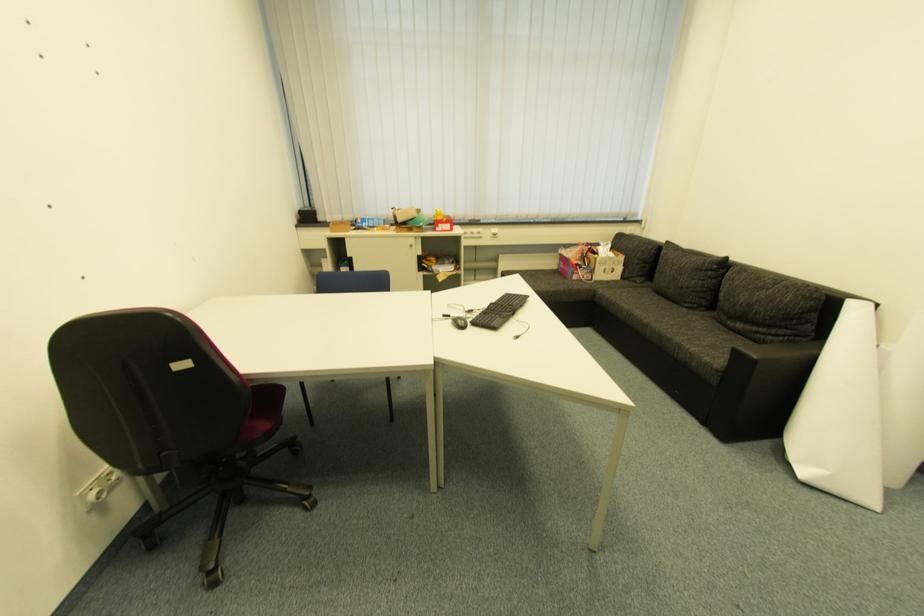
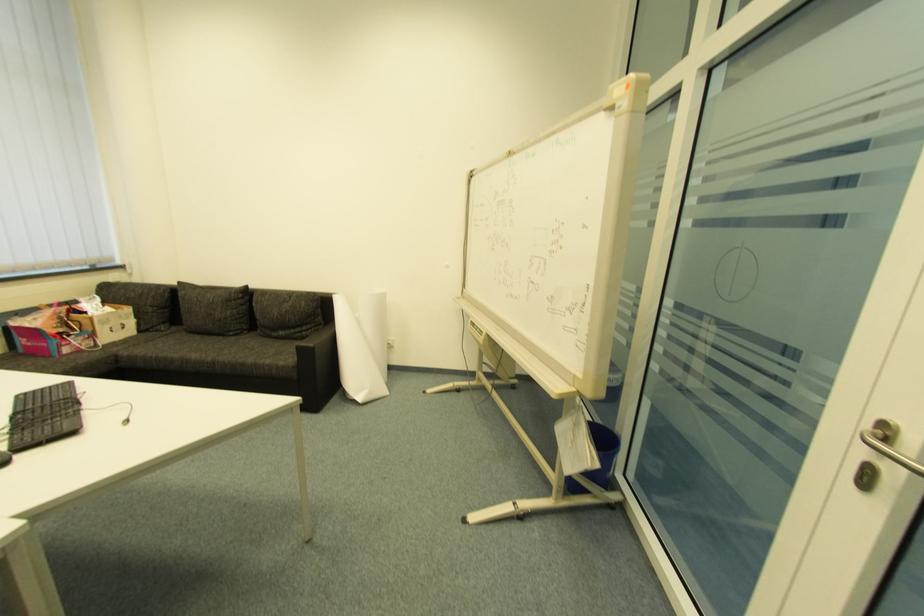
Question: The camera is either moving clockwise (left) or counter-clockwise (right) around the object. The first image is from the beginning of the video and the second image is from the end. Is the camera moving left or right when shooting the video?

Choices:
 (A) Left
 (B) Right

Answer: (A)